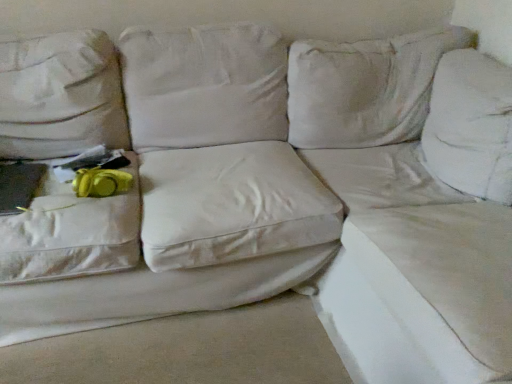
Question: Is white fabric sheet at lower right, which is counted as the first sheet, starting from the left, turned away from yellow fabric at left?

Choices:
 (A) yes
 (B) no

Answer: (B)

Question: Is white fabric sheet at lower right, which is the second sheet from right to left, further to camera compared to yellow fabric at left?

Choices:
 (A) no
 (B) yes

Answer: (A)

Question: Is white fabric sheet at lower right, which is the second sheet from right to left, closer to the viewer compared to yellow fabric at left?

Choices:
 (A) yes
 (B) no

Answer: (A)

Question: From the image's perspective, is white fabric sheet at lower right, which is the second sheet from right to left, located beneath yellow fabric at left?

Choices:
 (A) yes
 (B) no

Answer: (A)

Question: Is white fabric sheet at lower right, which is counted as the first sheet, starting from the left, far from yellow fabric at left?

Choices:
 (A) no
 (B) yes

Answer: (A)

Question: From a real-world perspective, is white fabric sheet at lower right, which is counted as the first sheet, starting from the left, under yellow fabric at left?

Choices:
 (A) yes
 (B) no

Answer: (A)

Question: Is white fabric couch at upper right, acting as the first sheet starting from the right, far from yellow fabric at left?

Choices:
 (A) no
 (B) yes

Answer: (A)

Question: Is white fabric couch at upper right, acting as the first sheet starting from the right, closer to camera compared to yellow fabric at left?

Choices:
 (A) no
 (B) yes

Answer: (B)

Question: Can you confirm if white fabric couch at upper right, positioned as the 2th sheet in left-to-right order, is positioned to the right of yellow fabric at left?

Choices:
 (A) no
 (B) yes

Answer: (B)

Question: Considering the relative sizes of white fabric couch at upper right, acting as the first sheet starting from the right, and yellow fabric at left in the image provided, is white fabric couch at upper right, acting as the first sheet starting from the right, shorter than yellow fabric at left?

Choices:
 (A) yes
 (B) no

Answer: (B)

Question: Would you say yellow fabric at left is part of white fabric couch at upper right, acting as the first sheet starting from the right,'s contents?

Choices:
 (A) yes
 (B) no

Answer: (B)

Question: Is white fabric couch at upper right, acting as the first sheet starting from the right, thinner than yellow fabric at left?

Choices:
 (A) yes
 (B) no

Answer: (B)

Question: Considering the relative sizes of white fabric couch at upper right, positioned as the 2th sheet in left-to-right order, and white fabric sheet at lower right, which is the second sheet from right to left, in the image provided, is white fabric couch at upper right, positioned as the 2th sheet in left-to-right order, shorter than white fabric sheet at lower right, which is the second sheet from right to left,?

Choices:
 (A) yes
 (B) no

Answer: (B)